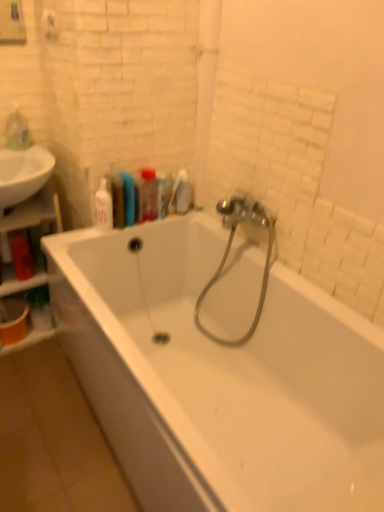
Locate an element on the screen. The width and height of the screenshot is (384, 512). vacant space in front of wooden shelf at left is located at coordinates (34, 365).